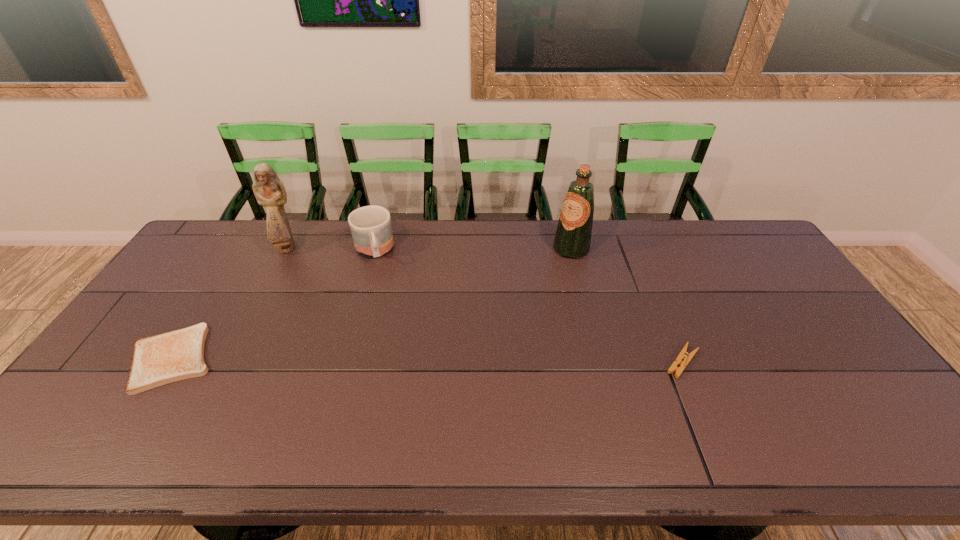
Locate an element on the screen. object situated at the near edge is located at coordinates (177, 355).

Where is `object present at the left edge`? The height and width of the screenshot is (540, 960). object present at the left edge is located at coordinates (177, 355).

The width and height of the screenshot is (960, 540). I want to click on object located at the near left corner, so click(177, 355).

This screenshot has height=540, width=960. Identify the location of vacant space at the far edge of the desktop. (626, 235).

Locate an element on the screen. The image size is (960, 540). blank area at the near edge is located at coordinates (717, 418).

The image size is (960, 540). I want to click on vacant space at the left edge, so click(x=175, y=319).

Locate an element on the screen. vacant area at the right edge is located at coordinates (822, 334).

You are a GUI agent. You are given a task and a screenshot of the screen. Output one action in this format:
    pyautogui.click(x=<x>, y=<y>)
    Task: Click on the free spot between the rightmost object and the olive oil
    Image resolution: width=960 pixels, height=540 pixels.
    Given the screenshot: What is the action you would take?
    pyautogui.click(x=627, y=305)

In order to click on free space between the figurine and the clothespin in this screenshot , I will do `click(484, 305)`.

The image size is (960, 540). In order to click on free spot between the shortest object and the second object from right to left in this screenshot , I will do `click(372, 303)`.